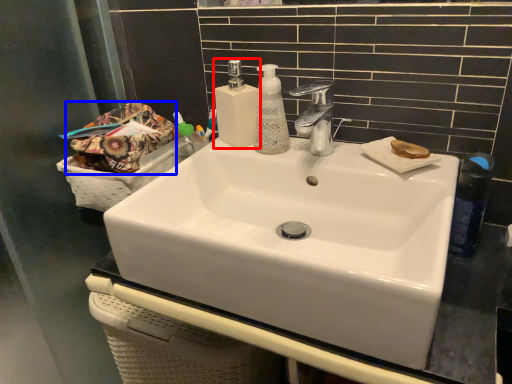
Question: Which point is closer to the camera, soap dispenser (highlighted by a red box) or material (highlighted by a blue box)?

Choices:
 (A) soap dispenser
 (B) material

Answer: (B)